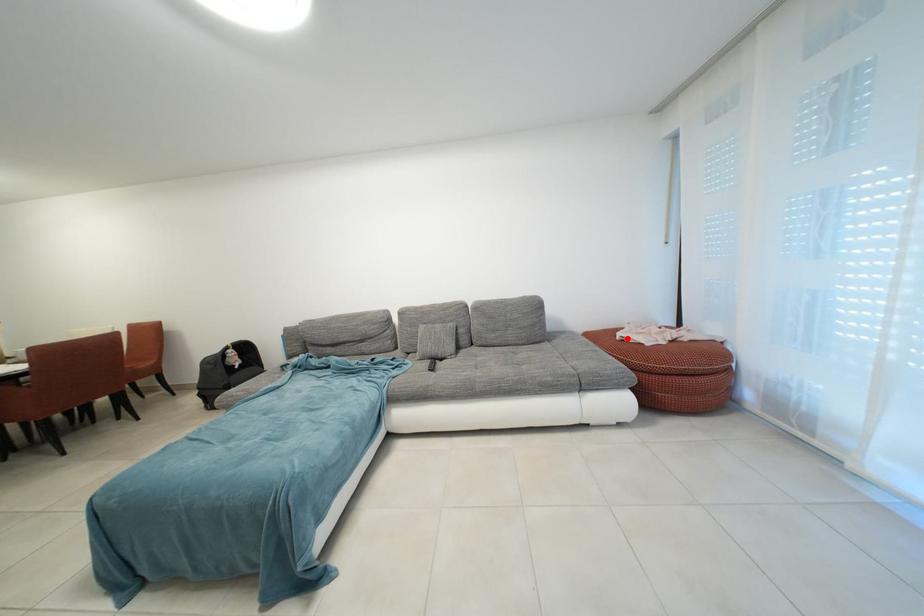
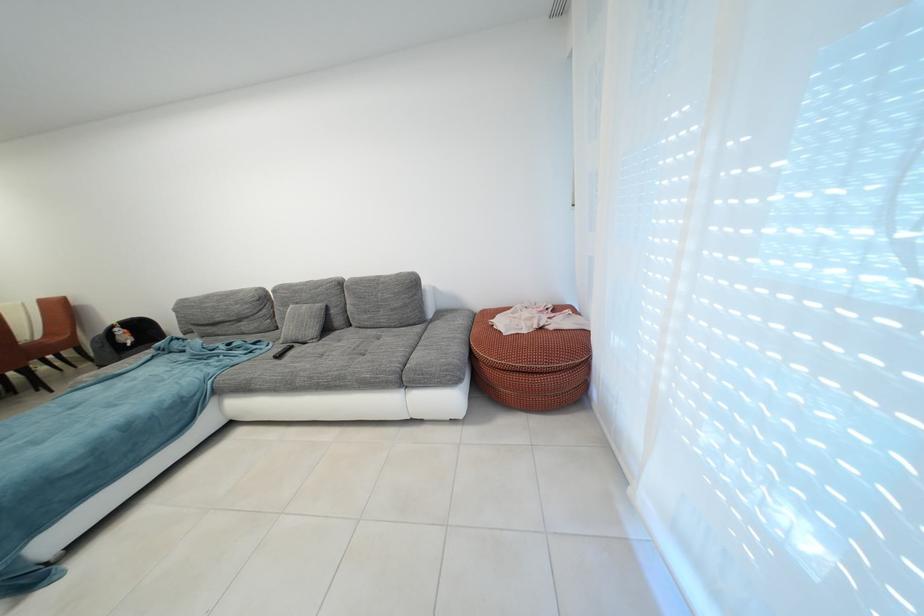
Locate, in the second image, the point that corresponds to the highlighted location in the first image.

(506, 321)